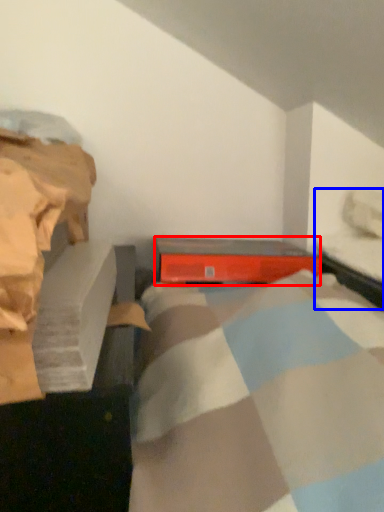
Question: Which object appears closest to the camera in this image, equipment (highlighted by a red box) or bed frame (highlighted by a blue box)?

Choices:
 (A) equipment
 (B) bed frame

Answer: (B)